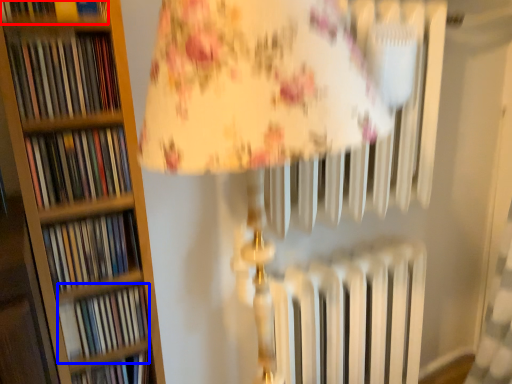
Question: Which object is closer to the camera taking this photo, book (highlighted by a red box) or book (highlighted by a blue box)?

Choices:
 (A) book
 (B) book

Answer: (A)